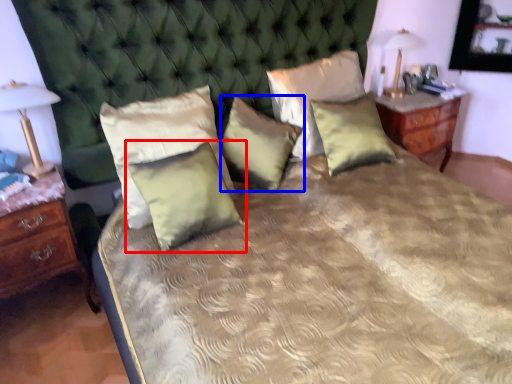
Question: Among these objects, which one is nearest to the camera, pillow (highlighted by a red box) or pillow (highlighted by a blue box)?

Choices:
 (A) pillow
 (B) pillow

Answer: (A)